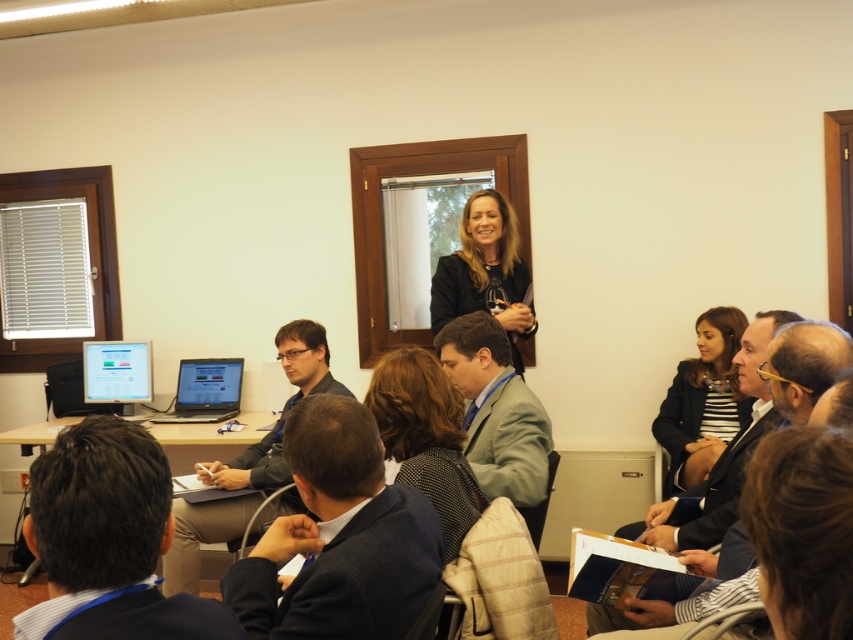
Between striped fabric jacket at center and black leather jacket at upper center, which one has more height?

striped fabric jacket at center

Which is more to the left, striped fabric jacket at center or black leather jacket at upper center?

Positioned to the left is black leather jacket at upper center.

Locate an element on the screen. striped fabric jacket at center is located at coordinates (703, 401).

Does point (666, 396) lie behind point (236, 380)?

No, it is in front of (236, 380).

What do you see at coordinates (703, 401) in the screenshot? I see `striped fabric jacket at center` at bounding box center [703, 401].

At what (x,y) coordinates should I click in order to perform the action: click on striped fabric jacket at center. Please return your answer as a coordinate pair (x, y). Looking at the image, I should click on (703, 401).

Is dark brown hair at center wider than satin black laptop at center?

No, dark brown hair at center is not wider than satin black laptop at center.

Between point (393, 452) and point (204, 388), which one is positioned behind?

The point (204, 388) is more distant.

Where is `dark brown hair at center`? The height and width of the screenshot is (640, 853). dark brown hair at center is located at coordinates (426, 436).